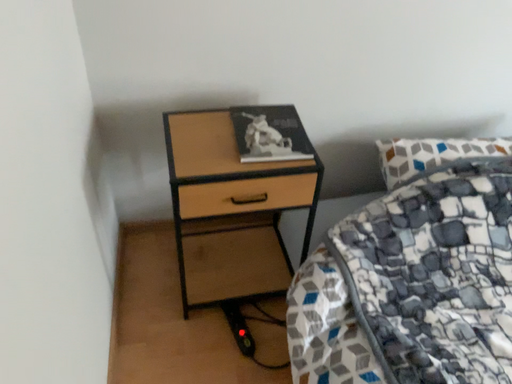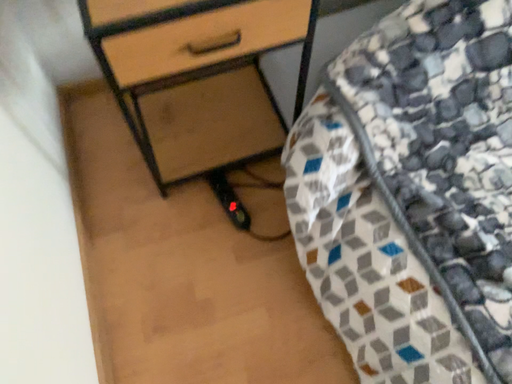
Question: How did the camera likely rotate when shooting the video?

Choices:
 (A) rotated downward
 (B) rotated upward

Answer: (A)